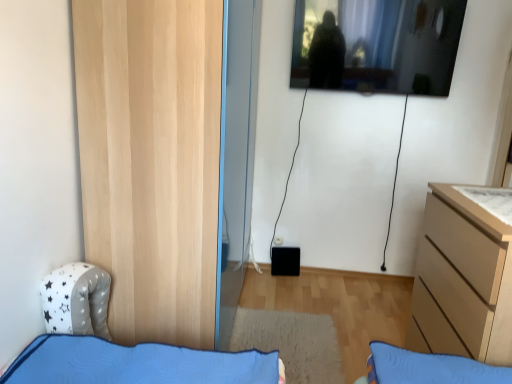
Question: Does natural wood door at left turn towards light wood chest of drawers at right?

Choices:
 (A) yes
 (B) no

Answer: (A)

Question: Can you confirm if natural wood door at left is taller than light wood chest of drawers at right?

Choices:
 (A) no
 (B) yes

Answer: (B)

Question: Is natural wood door at left to the right of light wood chest of drawers at right from the viewer's perspective?

Choices:
 (A) no
 (B) yes

Answer: (A)

Question: Can we say natural wood door at left lies outside light wood chest of drawers at right?

Choices:
 (A) yes
 (B) no

Answer: (A)

Question: Considering the relative positions of natural wood door at left and light wood chest of drawers at right in the image provided, is natural wood door at left in front of light wood chest of drawers at right?

Choices:
 (A) no
 (B) yes

Answer: (A)

Question: Is point (503, 218) positioned closer to the camera than point (78, 127)?

Choices:
 (A) farther
 (B) closer

Answer: (A)

Question: Is white matte drawer at upper right bigger or smaller than natural wood door at left?

Choices:
 (A) small
 (B) big

Answer: (A)

Question: In terms of height, does white matte drawer at upper right look taller or shorter compared to natural wood door at left?

Choices:
 (A) tall
 (B) short

Answer: (B)

Question: In terms of width, does white matte drawer at upper right look wider or thinner when compared to natural wood door at left?

Choices:
 (A) wide
 (B) thin

Answer: (B)

Question: From the image's perspective, relative to light wood chest of drawers at right, is transparent glass window at upper center above or below?

Choices:
 (A) above
 (B) below

Answer: (A)

Question: In terms of height, does transparent glass window at upper center look taller or shorter compared to light wood chest of drawers at right?

Choices:
 (A) short
 (B) tall

Answer: (A)

Question: Is transparent glass window at upper center to the left or to the right of light wood chest of drawers at right in the image?

Choices:
 (A) right
 (B) left

Answer: (B)

Question: Is transparent glass window at upper center spatially inside light wood chest of drawers at right, or outside of it?

Choices:
 (A) inside
 (B) outside

Answer: (B)

Question: Is light wood chest of drawers at right taller or shorter than transparent glass window at upper center?

Choices:
 (A) short
 (B) tall

Answer: (B)

Question: Considering the relative positions of light wood chest of drawers at right and transparent glass window at upper center in the image provided, is light wood chest of drawers at right to the left or to the right of transparent glass window at upper center?

Choices:
 (A) left
 (B) right

Answer: (B)